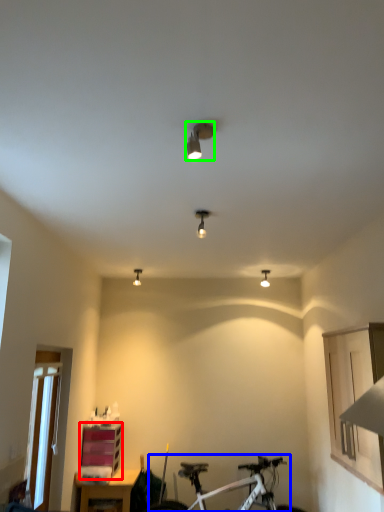
Question: Which object is positioned closest to shelf (highlighted by a red box)? Select from bicycle (highlighted by a blue box) and light fixture (highlighted by a green box).

Choices:
 (A) bicycle
 (B) light fixture

Answer: (A)